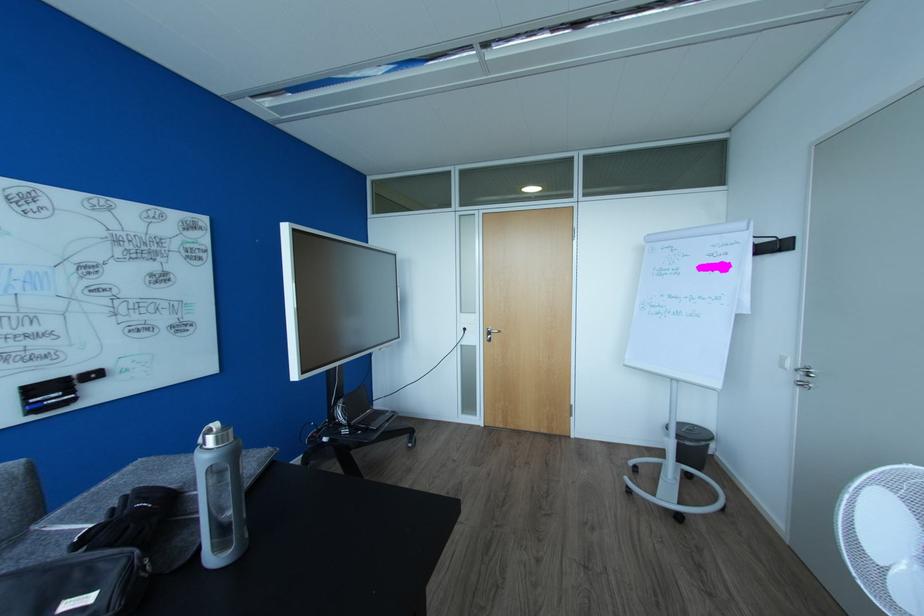
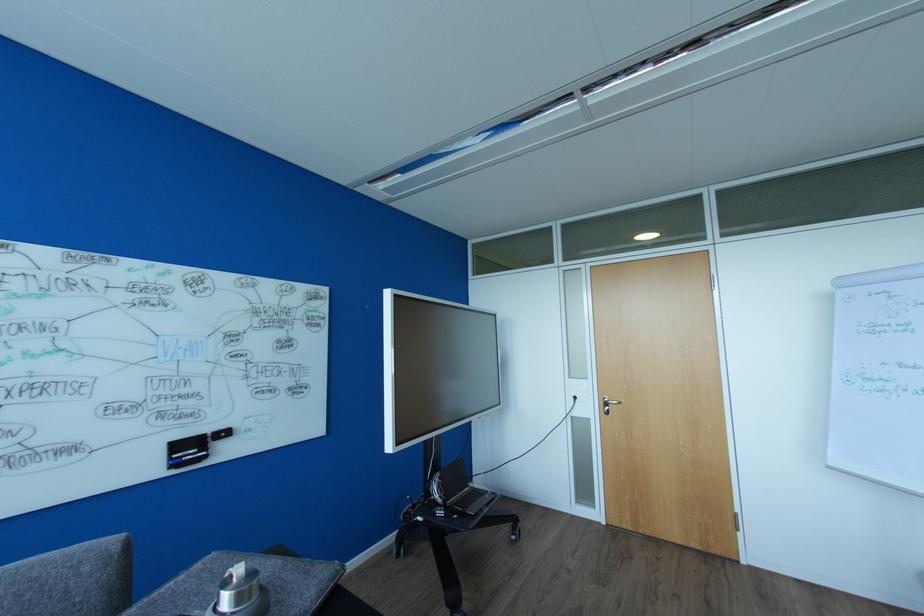
Find the pixel in the second image that matches the point at 30,405 in the first image.

(175, 460)